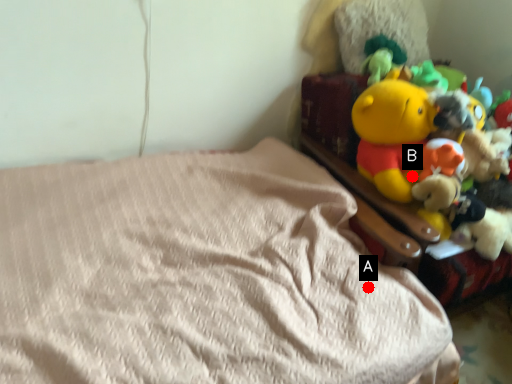
Question: Two points are circled on the image, labeled by A and B beside each circle. Which point is closer to the camera taking this photo?

Choices:
 (A) A is closer
 (B) B is closer

Answer: (A)